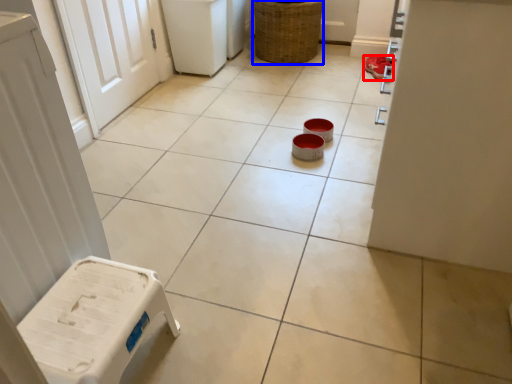
Question: Which of the following is the farthest to the observer, footwear (highlighted by a red box) or basket (highlighted by a blue box)?

Choices:
 (A) footwear
 (B) basket

Answer: (A)